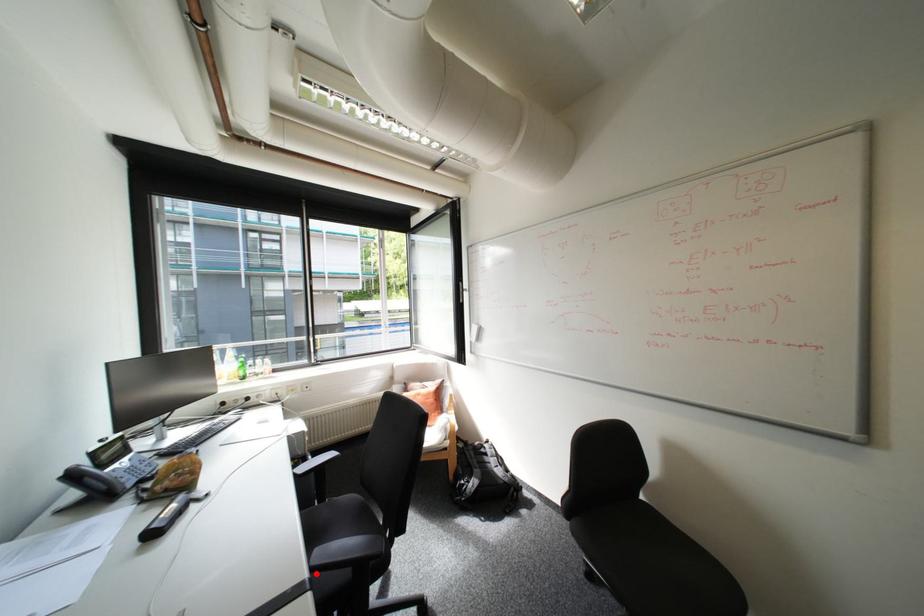
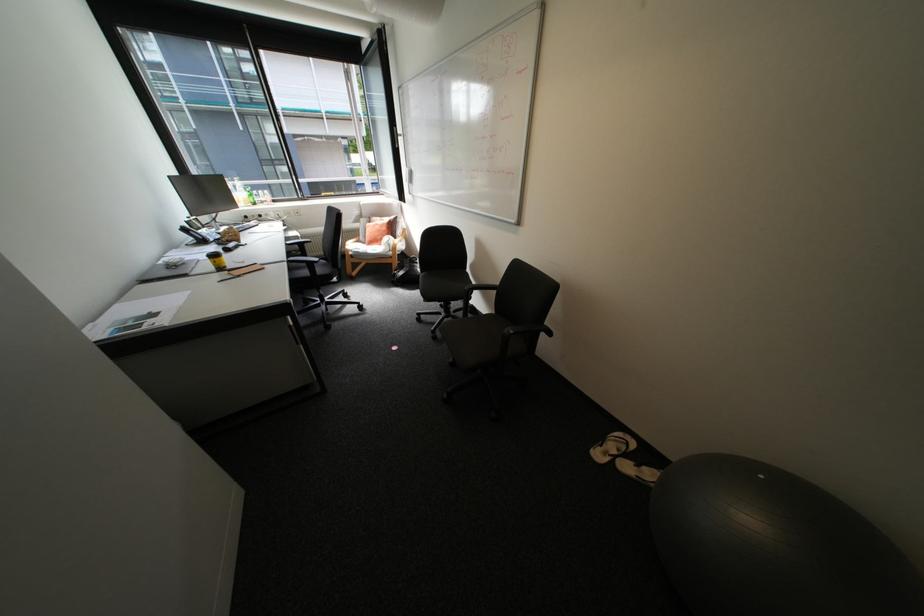
Question: A red point is marked in image1. In image2, is the corresponding 3D point closer to the camera or farther? Reply with the corresponding letter.

Choices:
 (A) The corresponding 3D point is closer.
 (B) The corresponding 3D point is farther.

Answer: (A)